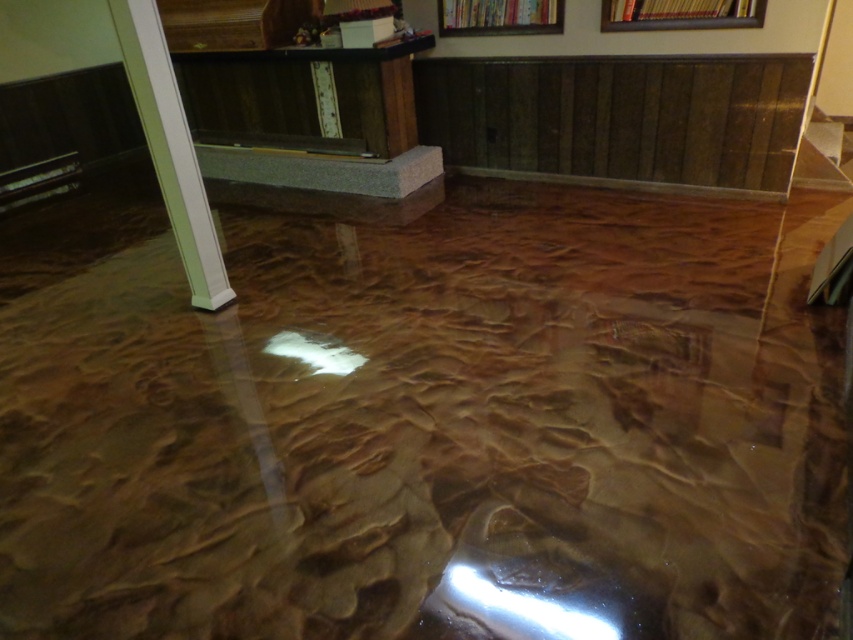
Question: Which of the following is the farthest from the observer?

Choices:
 (A) white glossy pillar at left
 (B) wooden picture frame at upper center
 (C) metallic gold picture frame at upper center

Answer: (C)

Question: Is white glossy pillar at left positioned behind wooden picture frame at upper center?

Choices:
 (A) no
 (B) yes

Answer: (A)

Question: Which object is positioned farthest from the metallic gold picture frame at upper center?

Choices:
 (A) white glossy pillar at left
 (B) wooden picture frame at upper center

Answer: (A)

Question: Is wooden picture frame at upper center above metallic gold picture frame at upper center?

Choices:
 (A) yes
 (B) no

Answer: (B)

Question: Is white glossy pillar at left to the right of wooden picture frame at upper center from the viewer's perspective?

Choices:
 (A) no
 (B) yes

Answer: (A)

Question: Estimate the real-world distances between objects in this image. Which object is closer to the metallic gold picture frame at upper center?

Choices:
 (A) white glossy pillar at left
 (B) wooden picture frame at upper center

Answer: (B)